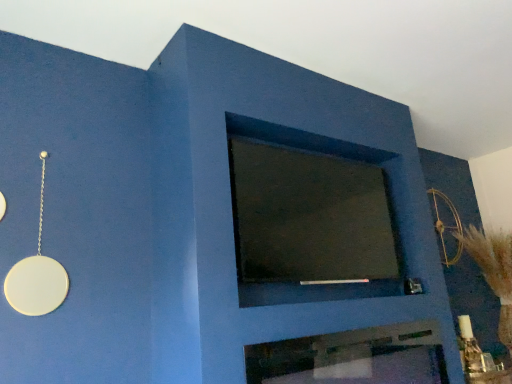
Question: Should I look upward or downward to see dark matte glass at center?

Choices:
 (A) up
 (B) down

Answer: (B)

Question: From a real-world perspective, is metallic silver fireplace at center positioned over gold metallic bow at upper right based on gravity?

Choices:
 (A) no
 (B) yes

Answer: (A)

Question: Is gold metallic bow at upper right located within metallic silver fireplace at center?

Choices:
 (A) no
 (B) yes

Answer: (A)

Question: Is metallic silver fireplace at center positioned with its back to gold metallic bow at upper right?

Choices:
 (A) yes
 (B) no

Answer: (B)

Question: Are metallic silver fireplace at center and gold metallic bow at upper right located far from each other?

Choices:
 (A) yes
 (B) no

Answer: (A)

Question: Does metallic silver fireplace at center have a greater width compared to gold metallic bow at upper right?

Choices:
 (A) no
 (B) yes

Answer: (B)

Question: From a real-world perspective, is metallic silver fireplace at center positioned under gold metallic bow at upper right based on gravity?

Choices:
 (A) yes
 (B) no

Answer: (A)

Question: Considering the relative positions of dark matte glass at center and gold metallic bow at upper right in the image provided, is dark matte glass at center to the left of gold metallic bow at upper right from the viewer's perspective?

Choices:
 (A) no
 (B) yes

Answer: (B)

Question: From the image's perspective, is dark matte glass at center on gold metallic bow at upper right?

Choices:
 (A) yes
 (B) no

Answer: (A)

Question: From a real-world perspective, is dark matte glass at center physically above gold metallic bow at upper right?

Choices:
 (A) no
 (B) yes

Answer: (A)

Question: Can you confirm if dark matte glass at center is thinner than gold metallic bow at upper right?

Choices:
 (A) yes
 (B) no

Answer: (B)

Question: Considering the relative positions of dark matte glass at center and gold metallic bow at upper right in the image provided, is dark matte glass at center in front of gold metallic bow at upper right?

Choices:
 (A) no
 (B) yes

Answer: (B)

Question: Would you consider dark matte glass at center to be distant from gold metallic bow at upper right?

Choices:
 (A) no
 (B) yes

Answer: (B)

Question: Does dark matte glass at center have a smaller size compared to metallic silver fireplace at center?

Choices:
 (A) yes
 (B) no

Answer: (B)